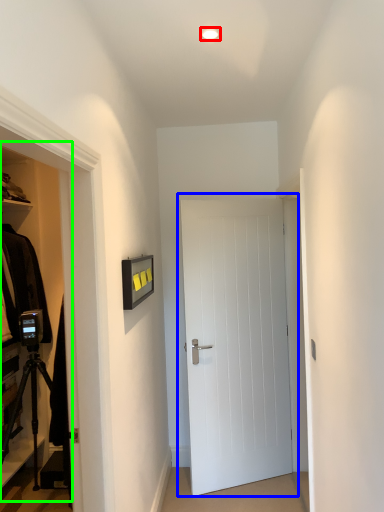
Question: Which object is the closest to the lighting (highlighted by a red box)? Choose among these: door (highlighted by a blue box) or dresser (highlighted by a green box).

Choices:
 (A) door
 (B) dresser

Answer: (A)